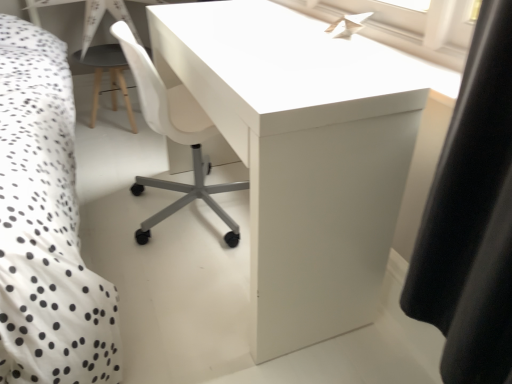
What is the approximate height of white glossy desk at center?

31.08 inches.

What is the approximate width of white paper airplane at upper center?

17.19 centimeters.

The height and width of the screenshot is (384, 512). I want to click on white glossy desk at center, so click(302, 152).

Could you tell me if white glossy desk at center is turned towards matte gray stool at left?

No, white glossy desk at center is not facing towards matte gray stool at left.

Is white glossy desk at center closer to camera compared to matte gray stool at left?

Yes, it is in front of matte gray stool at left.

Would you say white glossy desk at center is part of matte gray stool at left's contents?

No, matte gray stool at left does not contain white glossy desk at center.

Is matte gray stool at left turned away from white glossy desk at center?

No, white glossy desk at center is not at the back of matte gray stool at left.

Which object is wider, matte gray stool at left or white glossy desk at center?

Wider between the two is matte gray stool at left.

Between point (97, 80) and point (323, 126), which one is positioned behind?

The point (97, 80) is behind.

The width and height of the screenshot is (512, 384). I want to click on side table above the white paper airplane at upper center (from the image's perspective), so pos(110,76).

Is white paper airplane at upper center smaller than matte gray stool at left?

Correct, white paper airplane at upper center occupies less space than matte gray stool at left.

Is white paper airplane at upper center at the left side of matte gray stool at left?

Incorrect, white paper airplane at upper center is not on the left side of matte gray stool at left.

Is white glossy desk at center positioned far away from white paper airplane at upper center?

Actually, white glossy desk at center and white paper airplane at upper center are a little close together.

Relative to white paper airplane at upper center, is white glossy desk at center in front or behind?

Visually, white glossy desk at center is located in front of white paper airplane at upper center.

From the image's perspective, is white glossy desk at center on top of white paper airplane at upper center?

Incorrect, from the image's perspective, white glossy desk at center is lower than white paper airplane at upper center.

Is matte gray stool at left positioned in front of white paper airplane at upper center?

No, it is not.

From the image's perspective, is matte gray stool at left positioned above or below white paper airplane at upper center?

Based on their image positions, matte gray stool at left is located above white paper airplane at upper center.

What's the angular difference between matte gray stool at left and white paper airplane at upper center's facing directions?

88.6 degrees separate the facing orientations of matte gray stool at left and white paper airplane at upper center.

In terms of height, does white paper airplane at upper center look taller or shorter compared to white glossy desk at center?

Clearly, white paper airplane at upper center is shorter compared to white glossy desk at center.

Between white paper airplane at upper center and white glossy desk at center, which one has larger width?

white glossy desk at center is wider.

Where is `window screen on the right of white glossy desk at center`? window screen on the right of white glossy desk at center is located at coordinates (405, 26).

Is white paper airplane at upper center closer to camera compared to white glossy desk at center?

No, the depth of white paper airplane at upper center is greater than that of white glossy desk at center.

Locate an element on the screen. table that is above the matte gray stool at left (from a real-world perspective) is located at coordinates (302, 152).

This screenshot has height=384, width=512. Identify the location of table below the matte gray stool at left (from the image's perspective). (302, 152).

Considering their positions, is white paper airplane at upper center positioned further to white glossy desk at center than matte gray stool at left?

matte gray stool at left lies further to white glossy desk at center than the other object.

Looking at the image, which one is located further to white paper airplane at upper center, matte gray stool at left or white glossy desk at center?

matte gray stool at left is positioned further to the anchor white paper airplane at upper center.

Estimate the real-world distances between objects in this image. Which object is closer to matte gray stool at left, white glossy desk at center or white paper airplane at upper center?

white glossy desk at center lies closer to matte gray stool at left than the other object.

Based on their spatial positions, is white paper airplane at upper center or white glossy desk at center closer to matte gray stool at left?

white glossy desk at center.

Considering their positions, is white glossy desk at center positioned closer to white paper airplane at upper center than matte gray stool at left?

white glossy desk at center lies closer to white paper airplane at upper center than the other object.

When comparing their distances from white glossy desk at center, does matte gray stool at left or white paper airplane at upper center seem further?

Among the two, matte gray stool at left is located further to white glossy desk at center.

This screenshot has width=512, height=384. I want to click on window screen between white glossy desk at center and matte gray stool at left along the z-axis, so click(x=405, y=26).